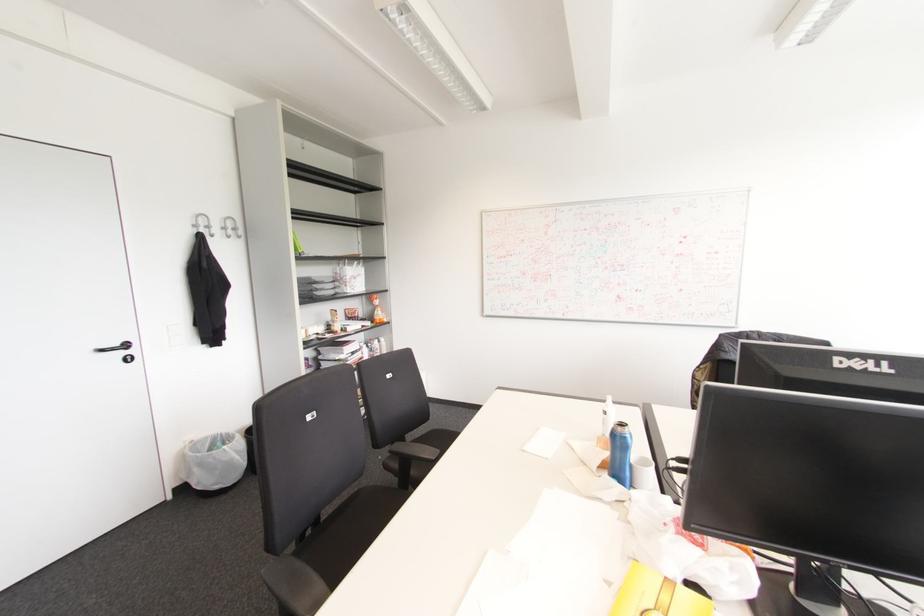
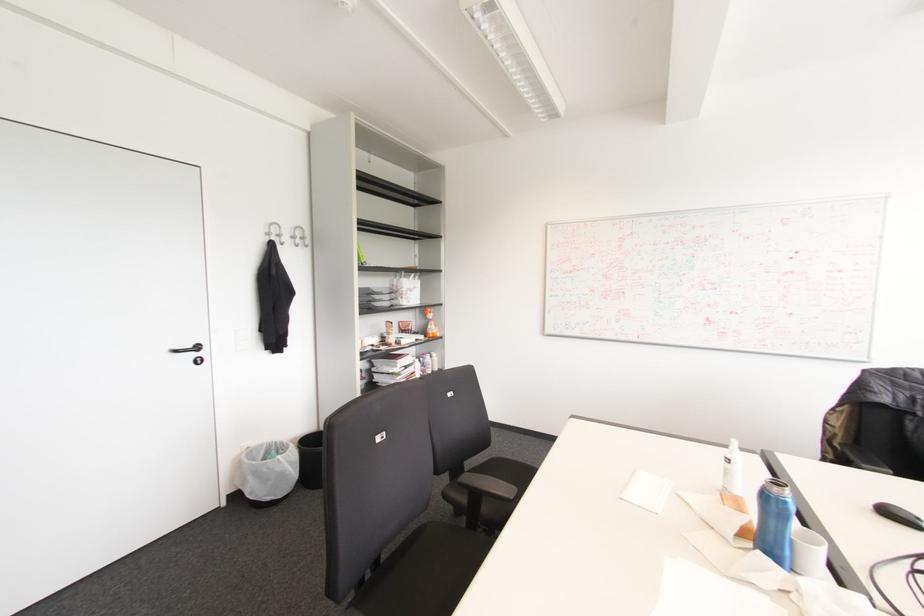
Question: The camera is either moving clockwise (left) or counter-clockwise (right) around the object. The first image is from the beginning of the video and the second image is from the end. Is the camera moving left or right when shooting the video?

Choices:
 (A) Left
 (B) Right

Answer: (B)